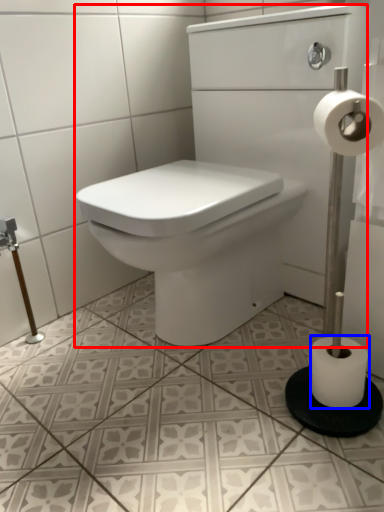
Question: Among these objects, which one is farthest to the camera, sink (highlighted by a red box) or toilet paper (highlighted by a blue box)?

Choices:
 (A) sink
 (B) toilet paper

Answer: (B)